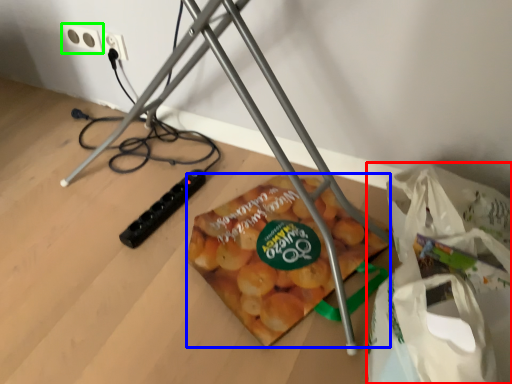
Question: Considering the real-world distances, which object is farthest from shopping bag (highlighted by a red box)? snack (highlighted by a blue box) or power plugs and sockets (highlighted by a green box)?

Choices:
 (A) snack
 (B) power plugs and sockets

Answer: (B)